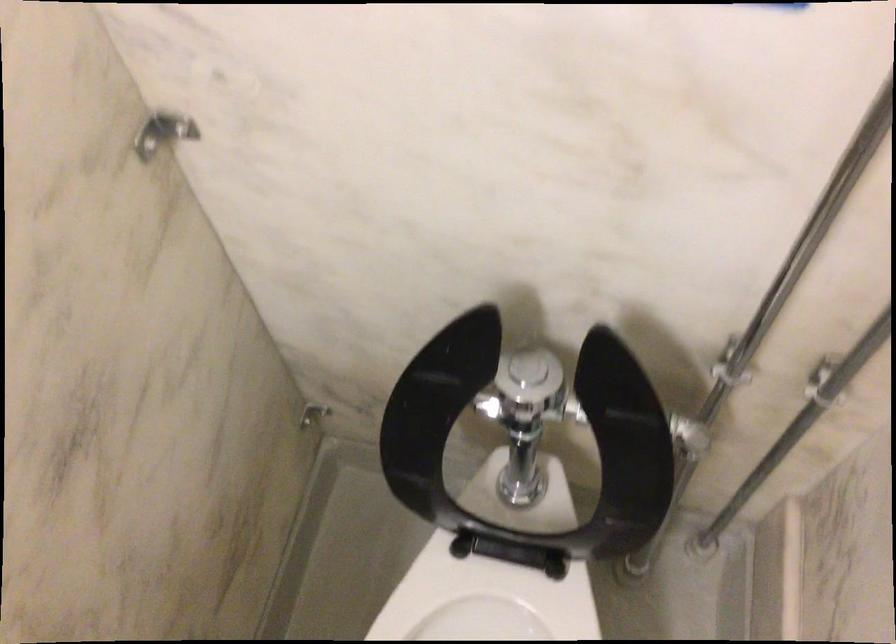
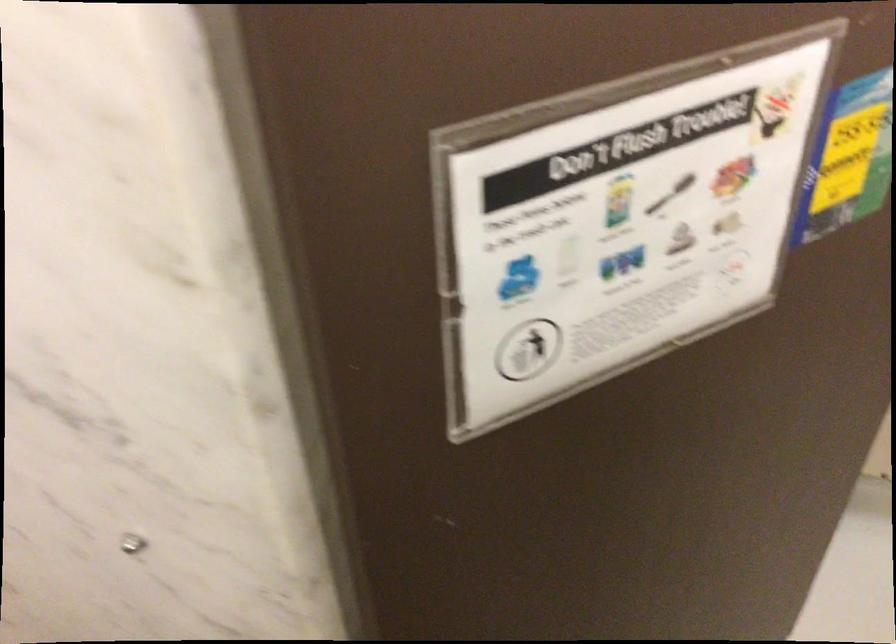
Question: The images are taken continuously from a first-person perspective. In which direction is your viewpoint rotating?

Choices:
 (A) Left
 (B) Right
 (C) Up
 (D) Down

Answer: (B)